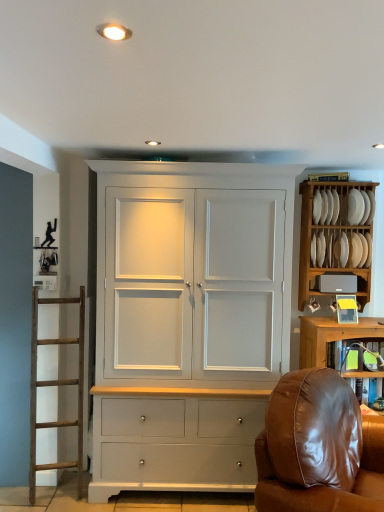
Identify the location of vacant region above matte gray speaker at upper right (from a real-world perspective). (347, 270).